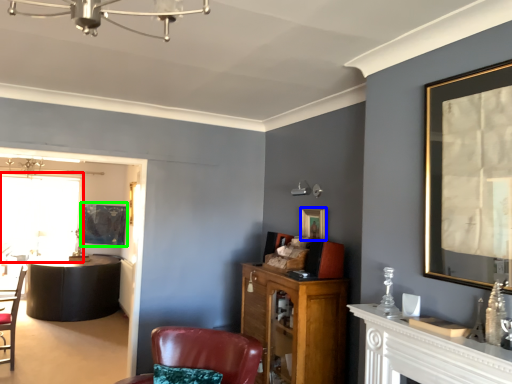
Question: Considering the real-world distances, which object is farthest from window screen (highlighted by a red box)? picture frame (highlighted by a blue box) or picture frame (highlighted by a green box)?

Choices:
 (A) picture frame
 (B) picture frame

Answer: (A)